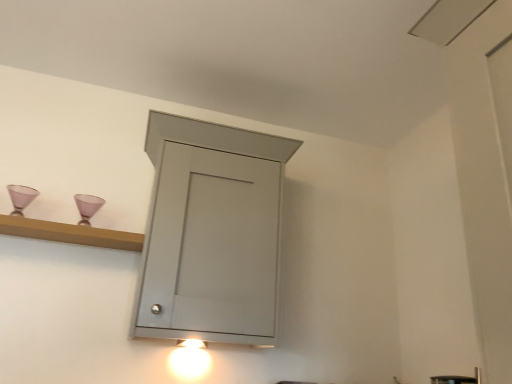
Question: Do you think matte white light fixture at lower center is within wooden shelf at upper left, or outside of it?

Choices:
 (A) outside
 (B) inside

Answer: (A)

Question: Considering the positions of matte white light fixture at lower center and wooden shelf at upper left in the image, is matte white light fixture at lower center taller or shorter than wooden shelf at upper left?

Choices:
 (A) tall
 (B) short

Answer: (A)

Question: Considering the real-world distances, which object is closest to the satin nickel faucet at lower right?

Choices:
 (A) matte white light fixture at lower center
 (B) matte gray cabinet at center
 (C) wooden shelf at upper left

Answer: (A)

Question: Based on their relative distances, which object is farther from the matte white light fixture at lower center?

Choices:
 (A) matte gray cabinet at center
 (B) satin nickel faucet at lower right
 (C) wooden shelf at upper left

Answer: (B)